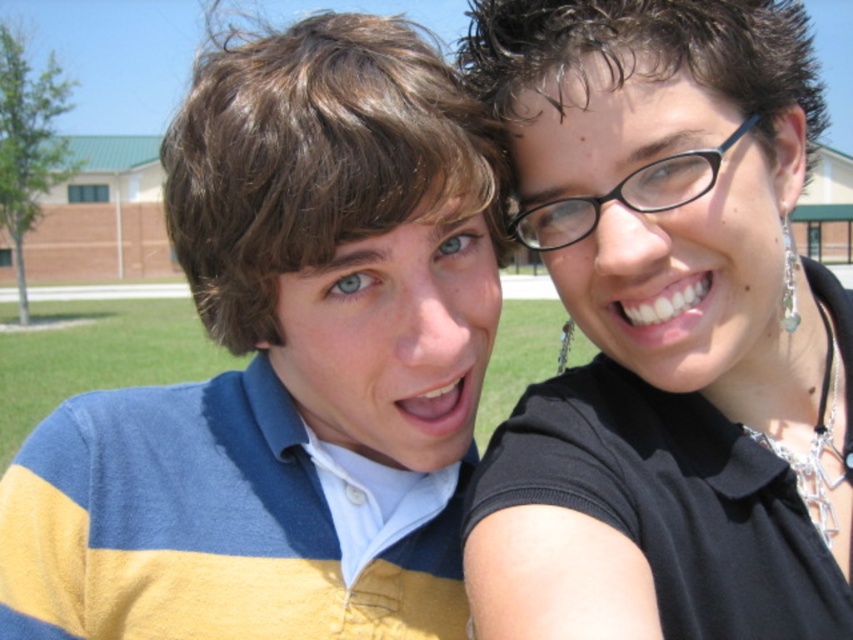
You are a photographer trying to capture a group photo of the yellow striped sweater at left and the black glossy shirt at upper right. What is the minimum distance you should keep between the camera and the subjects to ensure both are in focus?

The minimum distance you should keep between the camera and the subjects is 23 inches to ensure both the yellow striped sweater at left and the black glossy shirt at upper right are in focus, as they are 22.99 inches apart.

You are trying to take a photo of the black glossy shirt at upper right and the black plastic glasses at upper right. Which object should you focus on first to ensure both are in focus?

You should focus on the black glossy shirt at upper right first because it is closer to the camera than the black plastic glasses at upper right. By focusing on the closer object, the glasses will also be in focus due to the depth of field.

You are standing in the scene and want to place a small flag at the point closer to you between point (28, 513) and point (566, 236). Which point should you choose?

You should choose point (28, 513) because it is closer to you than point (566, 236).